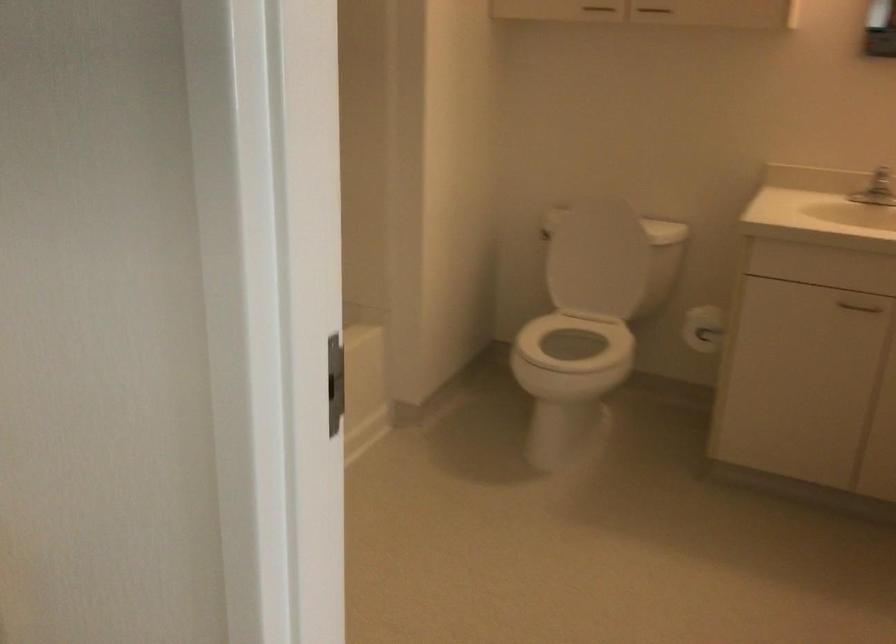
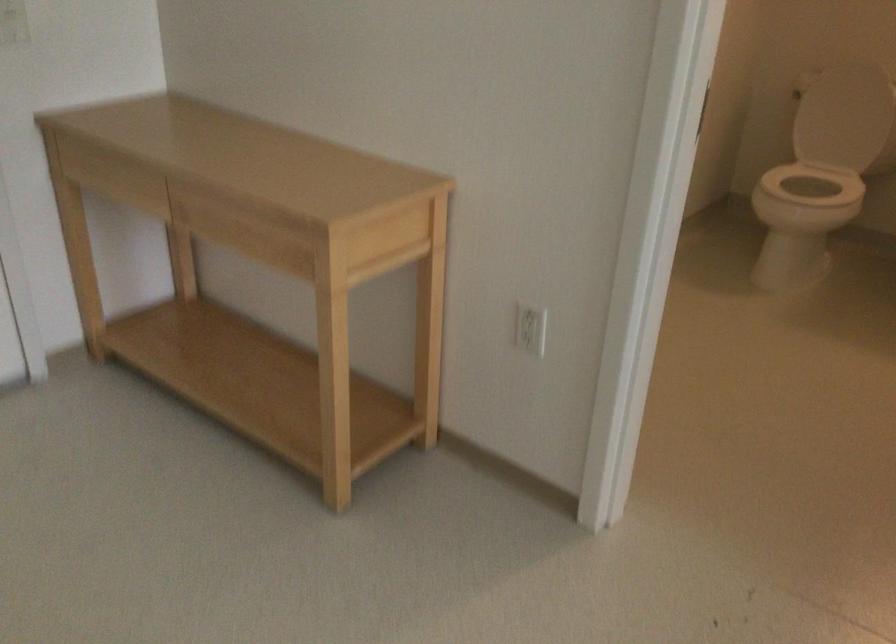
Find the pixel in the second image that matches pixel 554 351 in the first image.

(814, 184)